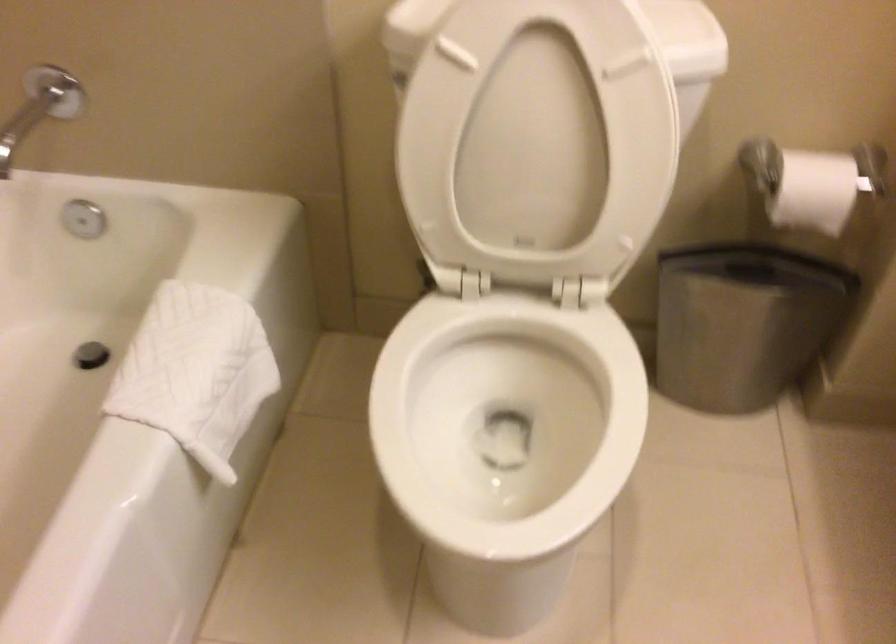
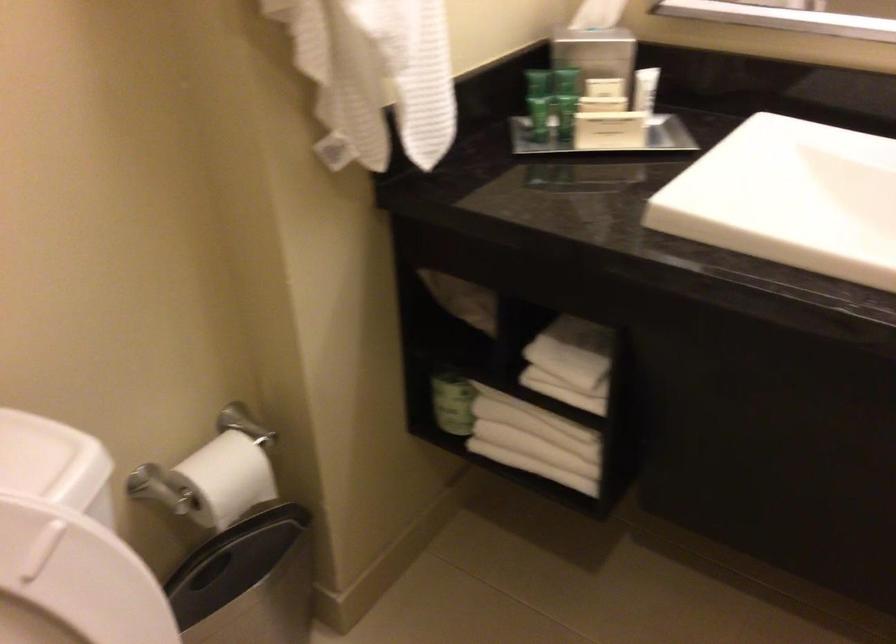
The point at (623, 87) is marked in the first image. Where is the corresponding point in the second image?

(73, 582)